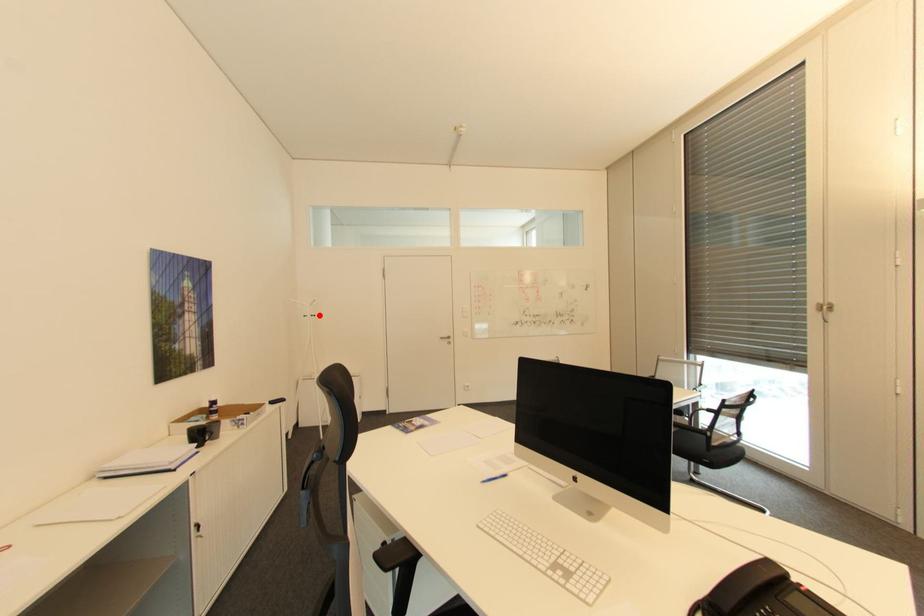
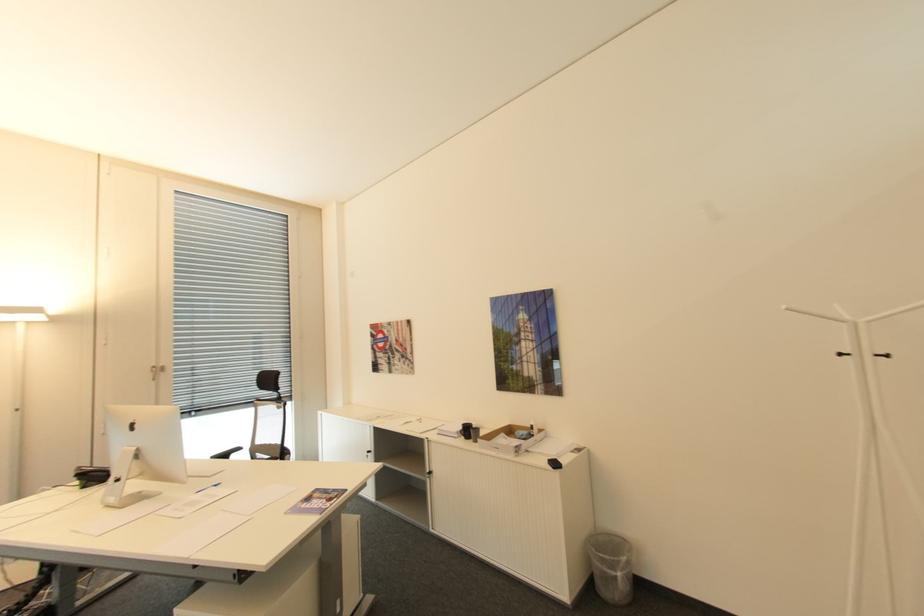
In the second image, find the point that corresponds to the highlighted location in the first image.

(894, 355)